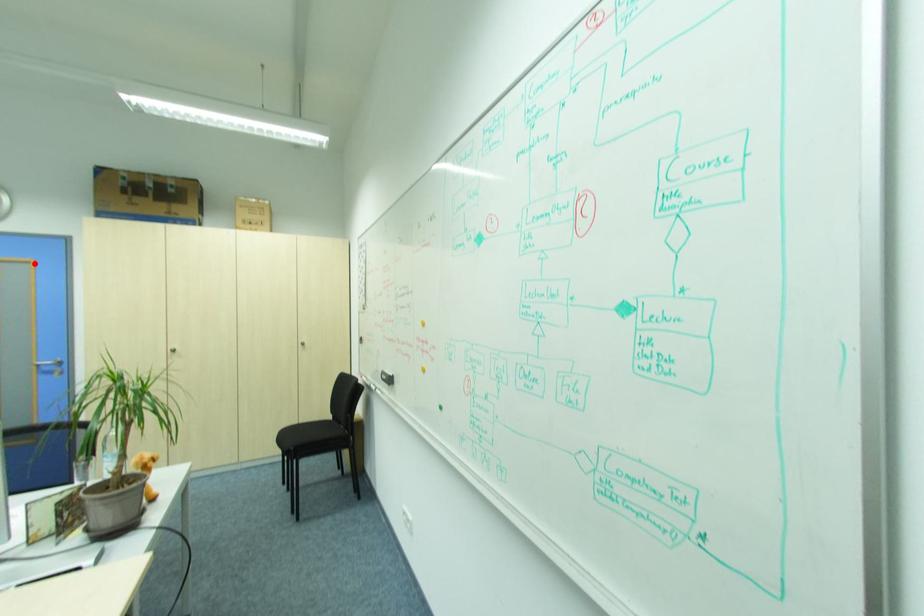
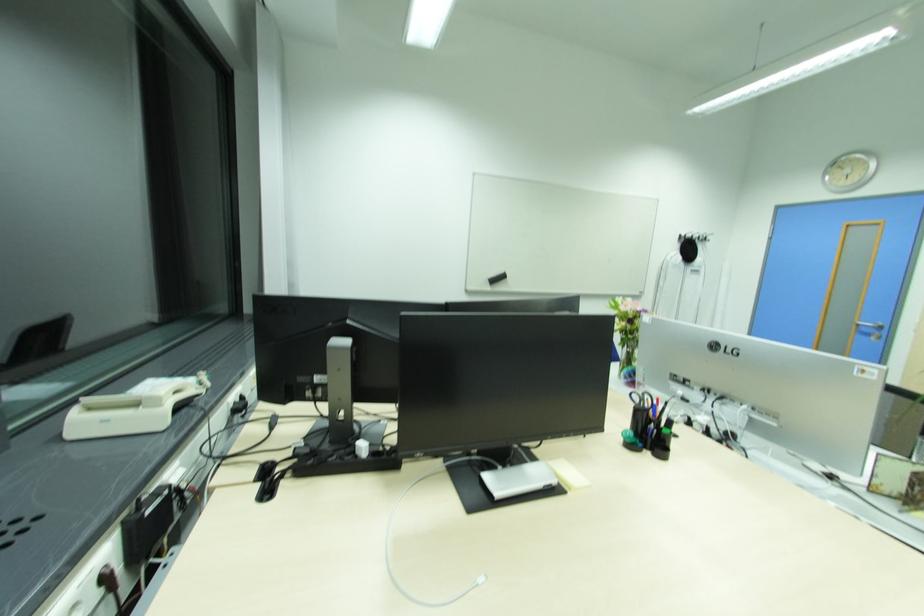
Where in the second image is the point corresponding to the highlighted location from the first image?

(882, 224)